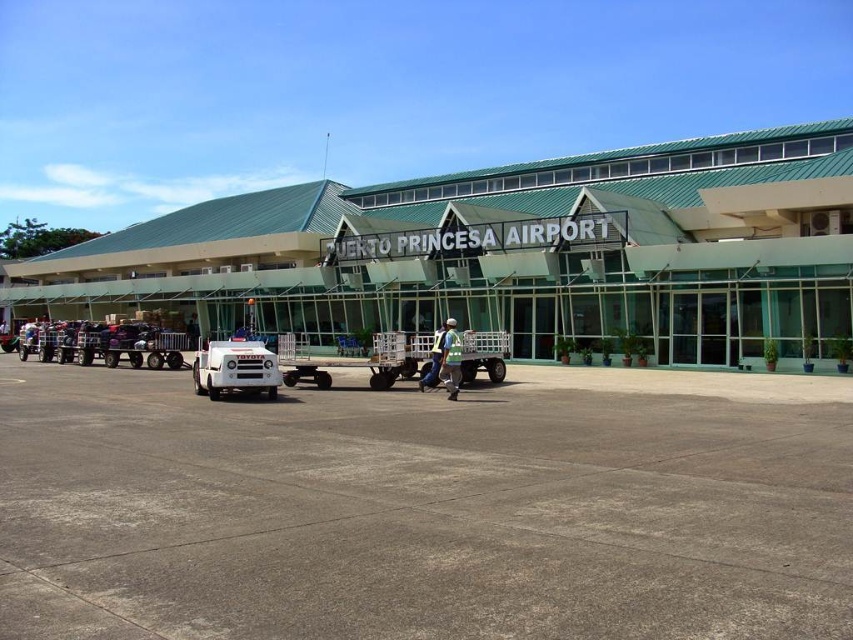
Which is more to the left, green glass building at center or white plastic cart at center?

green glass building at center

Is green glass building at center to the right of white plastic cart at center from the viewer's perspective?

No, green glass building at center is not to the right of white plastic cart at center.

Does point (351, 310) lie behind point (373, 339)?

Yes, it is.

Locate an element on the screen. green glass building at center is located at coordinates (509, 252).

Is light blue uniform at center smaller than white hard hat at center?

Indeed, light blue uniform at center has a smaller size compared to white hard hat at center.

Is point (454, 397) in front of point (444, 333)?

Yes, point (454, 397) is closer to viewer.

Does point (460, 349) lie behind point (427, 387)?

No, it is in front of (427, 387).

I want to click on light blue uniform at center, so click(450, 358).

How far apart are white plastic cart at center and light blue uniform at center?

The distance of white plastic cart at center from light blue uniform at center is 2.56 meters.

Can you confirm if white plastic cart at center is shorter than light blue uniform at center?

Yes.

Who is more forward, [485,332] or [444,358]?

Positioned in front is point [444,358].

In order to click on white plastic cart at center in this screenshot , I will do `click(399, 356)`.